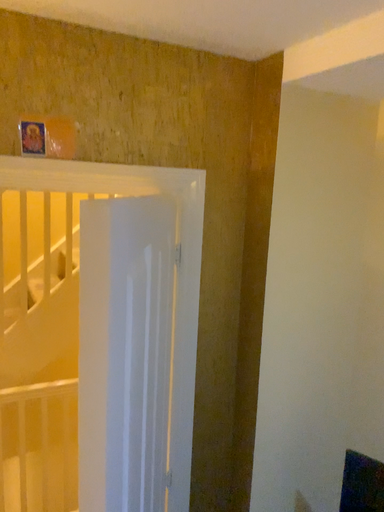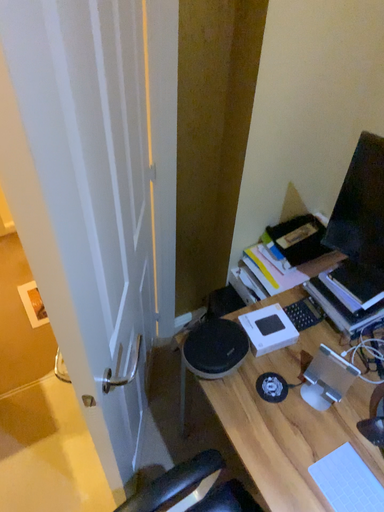
Question: Which way did the camera rotate in the video?

Choices:
 (A) rotated upward
 (B) rotated downward

Answer: (B)